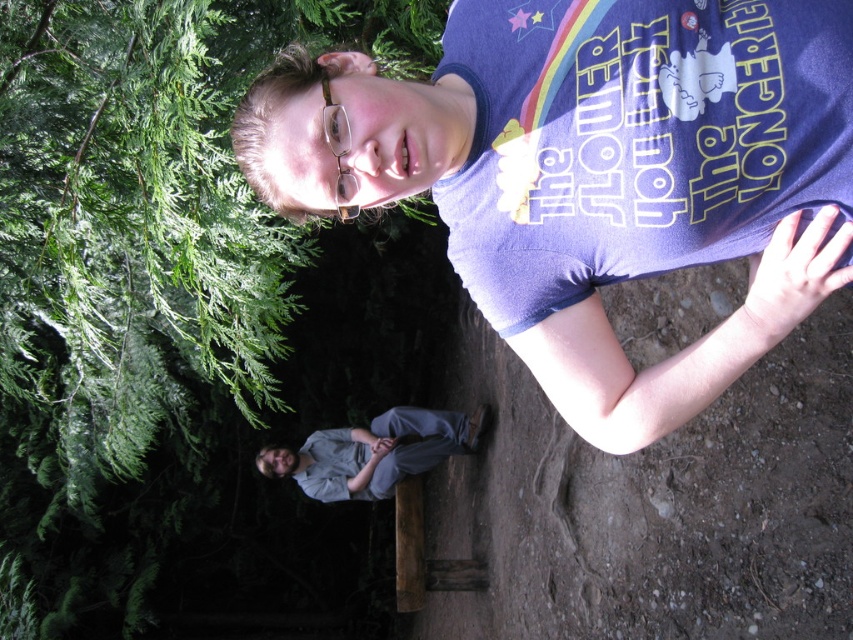
Consider the image. You are standing in a forest and see the green leafy tree at upper left and the gray cotton pants at lower center. Which object is positioned to the left of the other?

The green leafy tree at upper left is to the left of gray cotton pants at lower center.